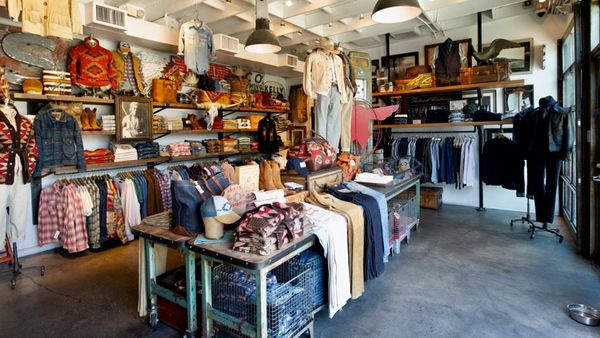
Image resolution: width=600 pixels, height=338 pixels. What are the coordinates of `floor` in the screenshot? It's located at (476, 293).